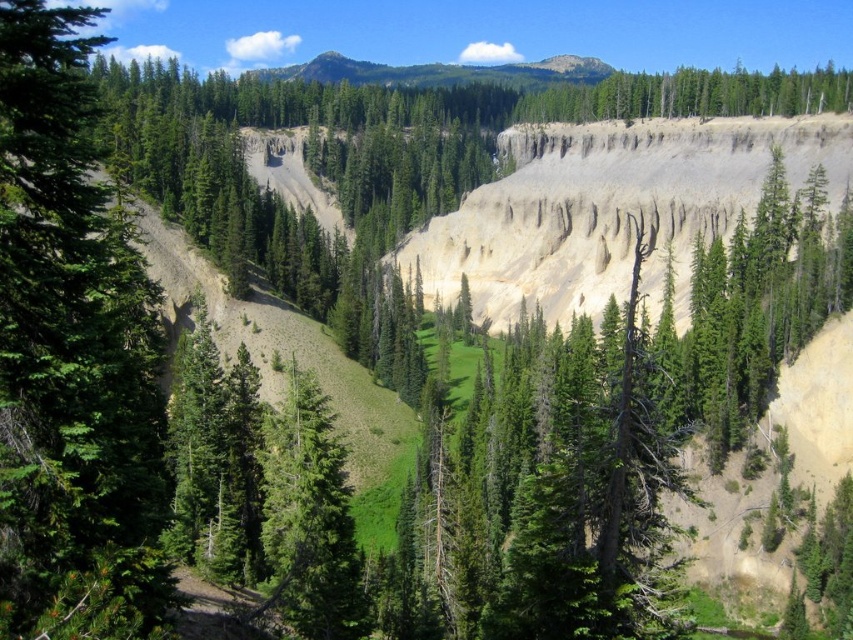
You are standing in the forested valley and want to reach a clearing 100 feet away. Is the green matte tree at left closer to you than the clearing?

The green matte tree at left is 104.49 feet from viewer, so it is farther away than the clearing which is 100 feet away. Therefore, the clearing is closer to you than the tree.

You are a hiker standing at the edge of the valley and want to take a photo of the green matte tree at left and the green forested mountain at upper center. Which object will appear smaller in the photo?

The green matte tree at left will appear smaller in the photo because it is shorter than the green forested mountain at upper center.

You are an environmental scientist examining the image. You need to determine the spatial relationship between the green textured tree at upper center and the green forested mountain at upper center. Which object is located to the right of the other?

The green textured tree at upper center is positioned on the right side of green forested mountain at upper center.